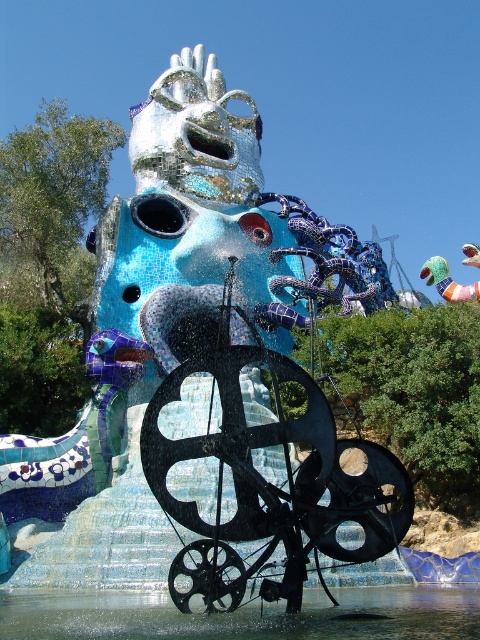
Which is more to the left, clear water at center or matte pink toy at upper right?

clear water at center

Can you confirm if clear water at center is bigger than matte pink toy at upper right?

No, clear water at center is not bigger than matte pink toy at upper right.

Is point (279, 602) more distant than point (441, 268)?

No.

Where is `clear water at center`? The image size is (480, 640). clear water at center is located at coordinates (241, 616).